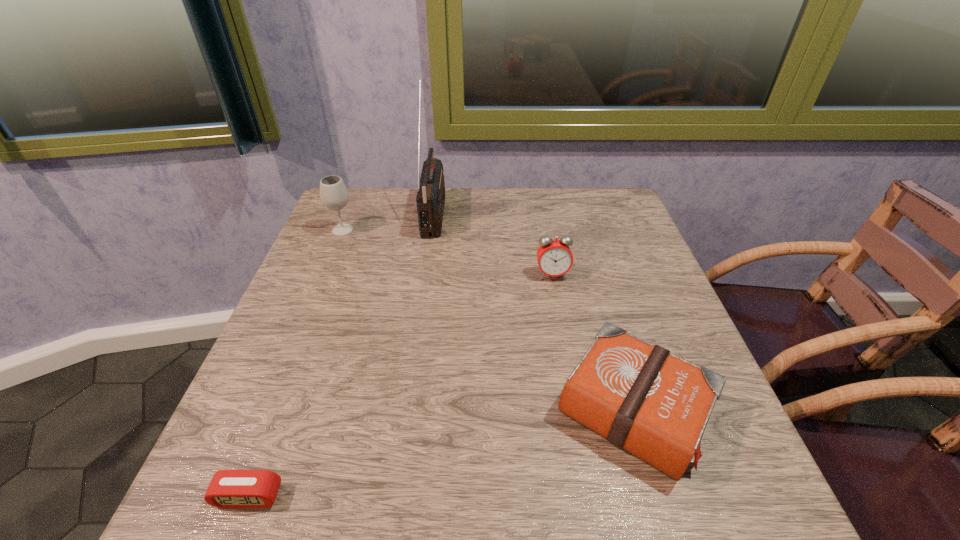
The width and height of the screenshot is (960, 540). I want to click on unoccupied position between the third tallest object and the third object from right to left, so click(x=493, y=244).

You are a GUI agent. You are given a task and a screenshot of the screen. Output one action in this format:
    pyautogui.click(x=<x>, y=<y>)
    Task: Click on the free spot between the nearer alarm clock and the radio receiver
    This screenshot has height=540, width=960.
    Given the screenshot: What is the action you would take?
    pyautogui.click(x=342, y=355)

Where is `free point between the fourth shortest object and the third tallest object`? The height and width of the screenshot is (540, 960). free point between the fourth shortest object and the third tallest object is located at coordinates (447, 252).

Locate an element on the screen. The image size is (960, 540). free space that is in between the wineglass and the fourth tallest object is located at coordinates (488, 321).

The width and height of the screenshot is (960, 540). I want to click on free area in between the radio receiver and the fourth shortest object, so click(389, 221).

Identify the location of free space between the shortest object and the third object from left to right. This screenshot has width=960, height=540. (342, 355).

Where is `unoccupied position between the second tallest object and the nearer alarm clock`? This screenshot has height=540, width=960. unoccupied position between the second tallest object and the nearer alarm clock is located at coordinates (296, 363).

Point out which object is positioned as the fourth nearest to the third object from left to right. Please provide its 2D coordinates. Your answer should be formatted as a tuple, i.e. [(x, y)], where the tuple contains the x and y coordinates of a point satisfying the conditions above.

[(228, 488)]

You are a GUI agent. You are given a task and a screenshot of the screen. Output one action in this format:
    pyautogui.click(x=<x>, y=<y>)
    Task: Click on the object that stands as the closest to the wineglass
    Image resolution: width=960 pixels, height=540 pixels.
    Given the screenshot: What is the action you would take?
    pyautogui.click(x=430, y=199)

Where is `vacant space that satisfies the following two spatial constraints: 1. on the front side of the second shortest object; 2. on the right side of the second tallest object`? The image size is (960, 540). vacant space that satisfies the following two spatial constraints: 1. on the front side of the second shortest object; 2. on the right side of the second tallest object is located at coordinates (269, 411).